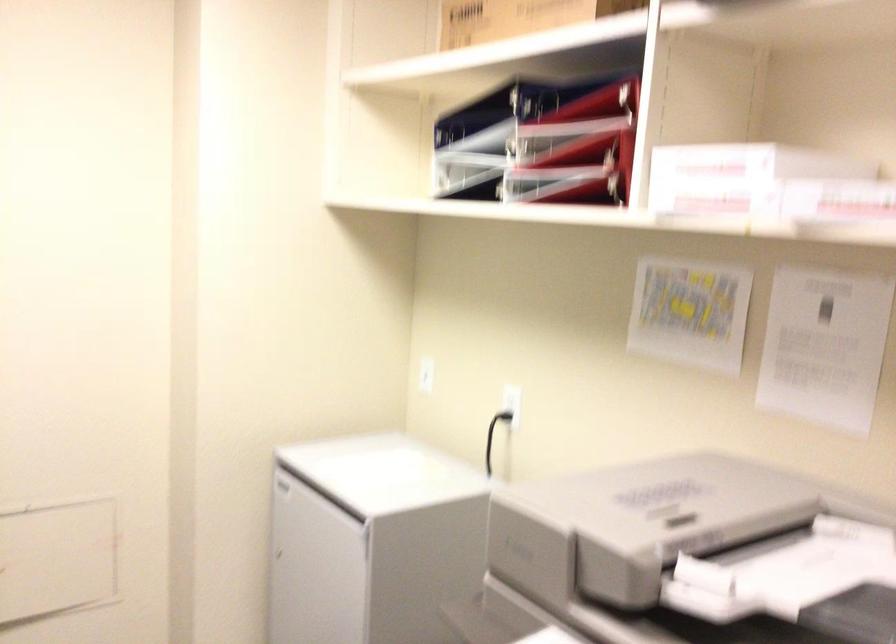
Which object does [469,146] point to?

It corresponds to the black binder in the image.